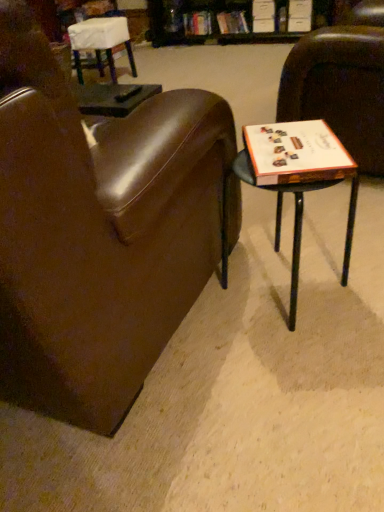
This screenshot has width=384, height=512. What are the coordinates of `vacant area on top of white fabric-covered chair at upper left, the first chair positioned from the back (from a real-world perspective)` in the screenshot? It's located at (93, 22).